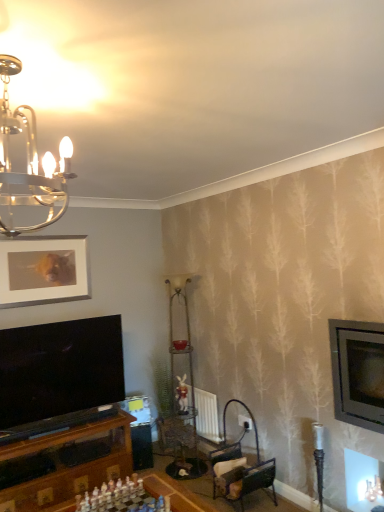
Question: From a real-world perspective, is metallic chandelier at upper left physically located above or below metallic dark brown chair at lower center?

Choices:
 (A) below
 (B) above

Answer: (B)

Question: Considering their positions, is metallic chandelier at upper left located in front of or behind metallic dark brown chair at lower center?

Choices:
 (A) behind
 (B) front

Answer: (B)

Question: Considering the real-world distances, which object is closest to the metallic silver television at right?

Choices:
 (A) matte white picture frame at upper left
 (B) matte plastic rabbit at center
 (C) metallic chandelier at upper left
 (D) white plastic chess set at center
 (E) metallic dark brown chair at lower center

Answer: (E)

Question: Considering the real-world distances, which object is closest to the white textured radiator at center?

Choices:
 (A) metallic silver television at right
 (B) matte plastic rabbit at center
 (C) metallic dark brown chair at lower center
 (D) metallic chandelier at upper left
 (E) white plastic chess set at center

Answer: (B)